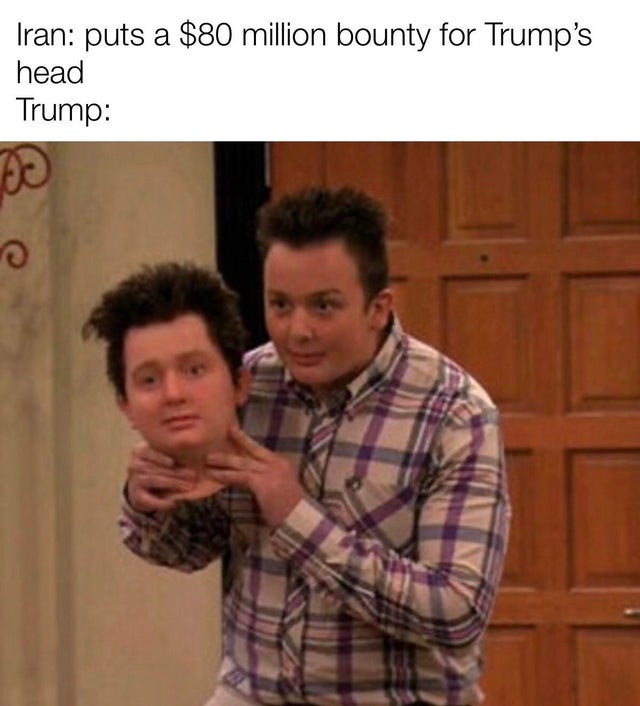
Find the location of a particular element. The image size is (640, 706). door is located at coordinates (557, 556).